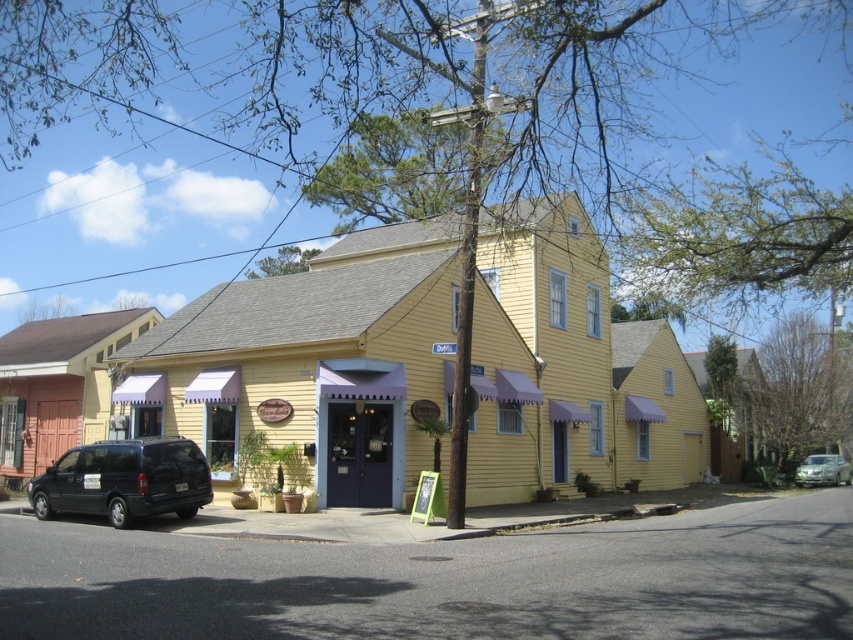
You are a delivery person trying to park your vehicle between the matte black van at lower left and the metallic silver sedan at lower right. Given that your delivery van is 5 meters long, can you fit it in the space between them?

The matte black van at lower left is larger than the metallic silver sedan at lower right, but the exact distance between them isn

You are a delivery person with a 2.5 meter wide truck. You need to park between the matte black van at lower left and the metallic silver sedan at lower right. Can your truck fit in the space between them?

The matte black van at lower left might be wider than metallic silver sedan at lower right, so the space between them may be insufficient for a 2.5 meter wide truck. It is uncertain and requires further measurement.

You are standing at the entrance of the two story yellow building with a gray roof. You need to move your matte black van at lower left closer to the building. How much distance do you need to move it in feet?

The matte black van at lower left is currently 50.89 feet away from the building, so you need to move it 50.89 feet closer to reach the building.